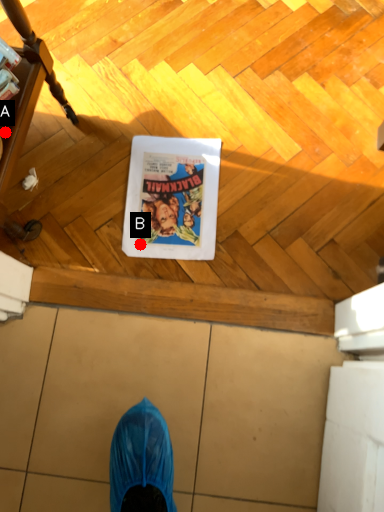
Question: Two points are circled on the image, labeled by A and B beside each circle. Which point is closer to the camera?

Choices:
 (A) A is closer
 (B) B is closer

Answer: (A)